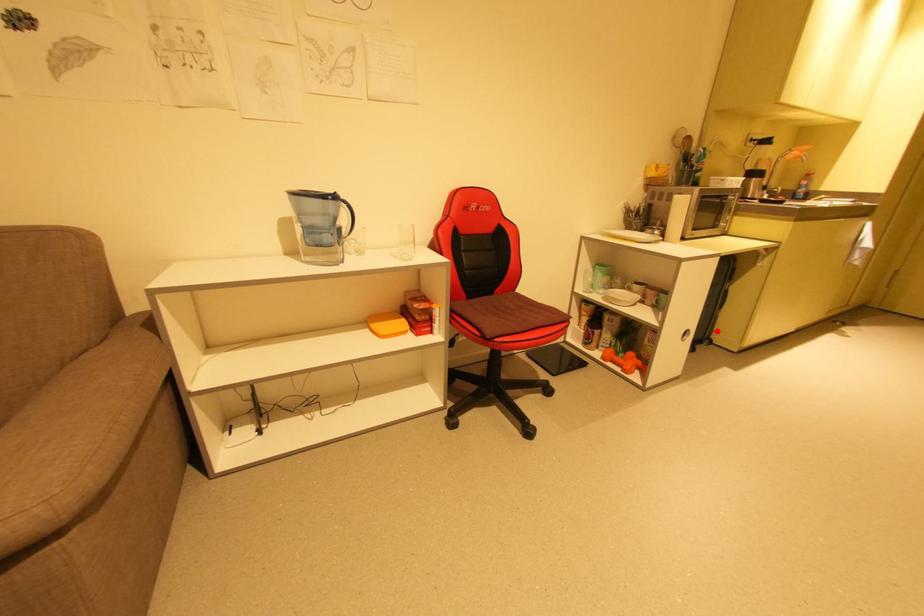
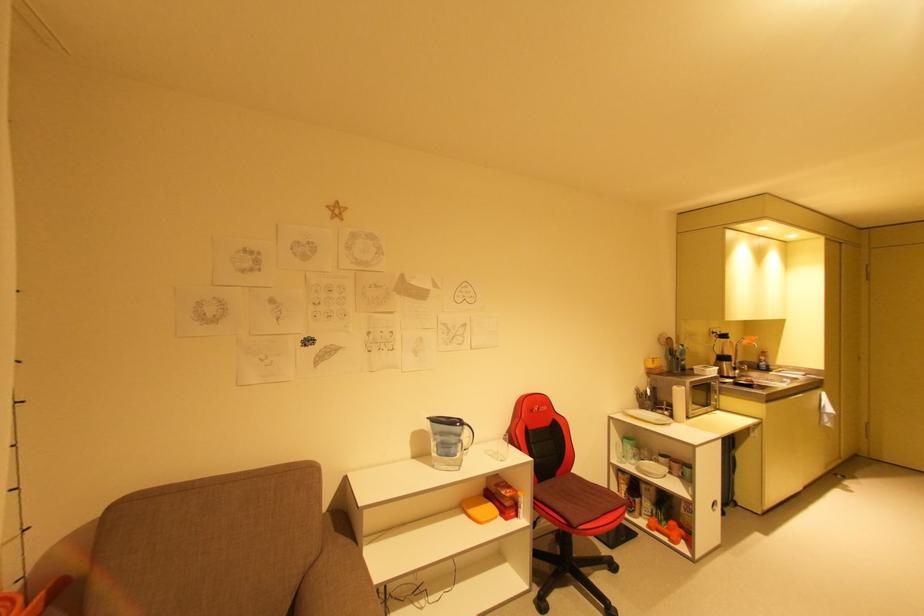
In the second image, find the point that corresponds to the highlighted location in the first image.

(737, 493)